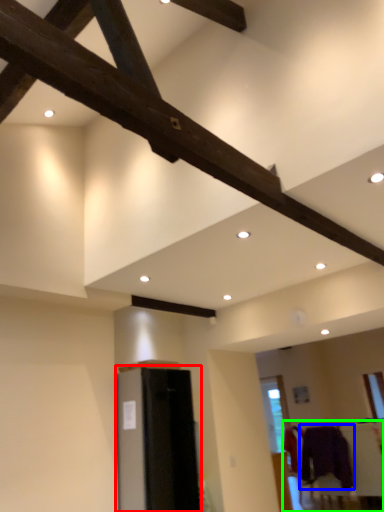
Question: Which is nearer to the furniture (highlighted by a red box)? clothing (highlighted by a blue box) or furniture (highlighted by a green box).

Choices:
 (A) clothing
 (B) furniture

Answer: (B)